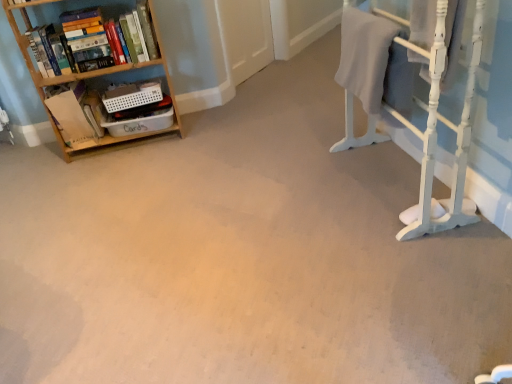
Question: Is gray cotton bath towel at upper right in front of white painted wood bunk bed at right?

Choices:
 (A) no
 (B) yes

Answer: (A)

Question: Is gray cotton bath towel at upper right turned away from white painted wood bunk bed at right?

Choices:
 (A) yes
 (B) no

Answer: (A)

Question: Can you confirm if gray cotton bath towel at upper right is positioned to the left of white painted wood bunk bed at right?

Choices:
 (A) no
 (B) yes

Answer: (B)

Question: Would you say white painted wood bunk bed at right is part of gray cotton bath towel at upper right's contents?

Choices:
 (A) no
 (B) yes

Answer: (A)

Question: Is gray cotton bath towel at upper right in contact with white painted wood bunk bed at right?

Choices:
 (A) yes
 (B) no

Answer: (B)

Question: From a real-world perspective, is gray cotton bath towel at upper right physically located above or below white painted wood bunk bed at right?

Choices:
 (A) above
 (B) below

Answer: (A)

Question: Visually, is gray cotton bath towel at upper right positioned to the left or to the right of white painted wood bunk bed at right?

Choices:
 (A) right
 (B) left

Answer: (B)

Question: Considering the positions of gray cotton bath towel at upper right and white painted wood bunk bed at right in the image, is gray cotton bath towel at upper right taller or shorter than white painted wood bunk bed at right?

Choices:
 (A) tall
 (B) short

Answer: (B)

Question: Would you say gray cotton bath towel at upper right is inside or outside white painted wood bunk bed at right?

Choices:
 (A) outside
 (B) inside

Answer: (B)

Question: Considering the positions of point (158, 33) and point (64, 29), is point (158, 33) closer or farther from the camera than point (64, 29)?

Choices:
 (A) closer
 (B) farther

Answer: (B)

Question: From a real-world perspective, relative to hardcover books at left, is wooden bookshelf at left vertically above or below?

Choices:
 (A) below
 (B) above

Answer: (A)

Question: Considering the positions of wooden bookshelf at left and hardcover books at left in the image, is wooden bookshelf at left bigger or smaller than hardcover books at left?

Choices:
 (A) small
 (B) big

Answer: (B)

Question: Which is correct: wooden bookshelf at left is inside hardcover books at left, or outside of it?

Choices:
 (A) inside
 (B) outside

Answer: (B)

Question: From a real-world perspective, is hardcover books at left above or below wooden bookshelf at left?

Choices:
 (A) above
 (B) below

Answer: (A)

Question: From their relative heights in the image, would you say hardcover books at left is taller or shorter than wooden bookshelf at left?

Choices:
 (A) tall
 (B) short

Answer: (B)